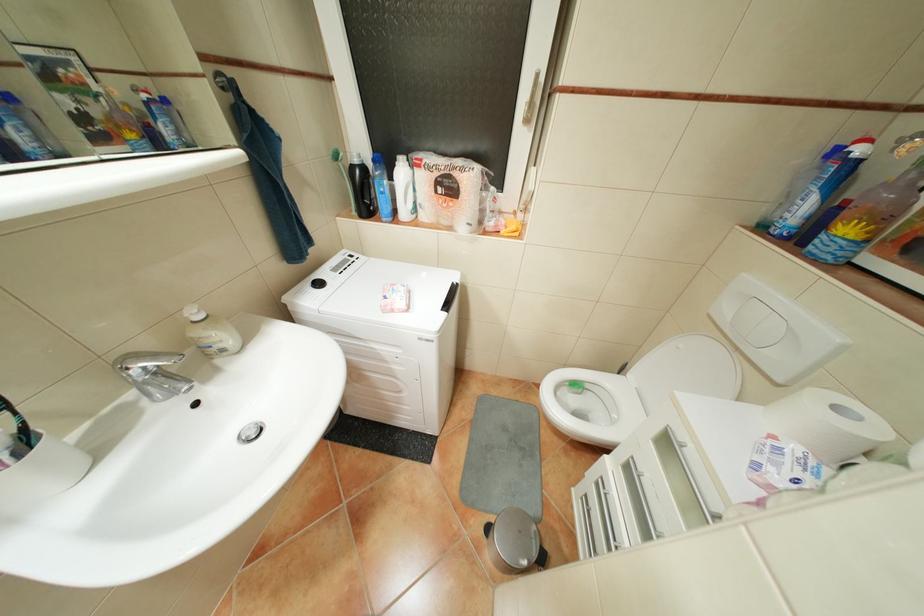
This screenshot has width=924, height=616. I want to click on black bottle, so 360,187.